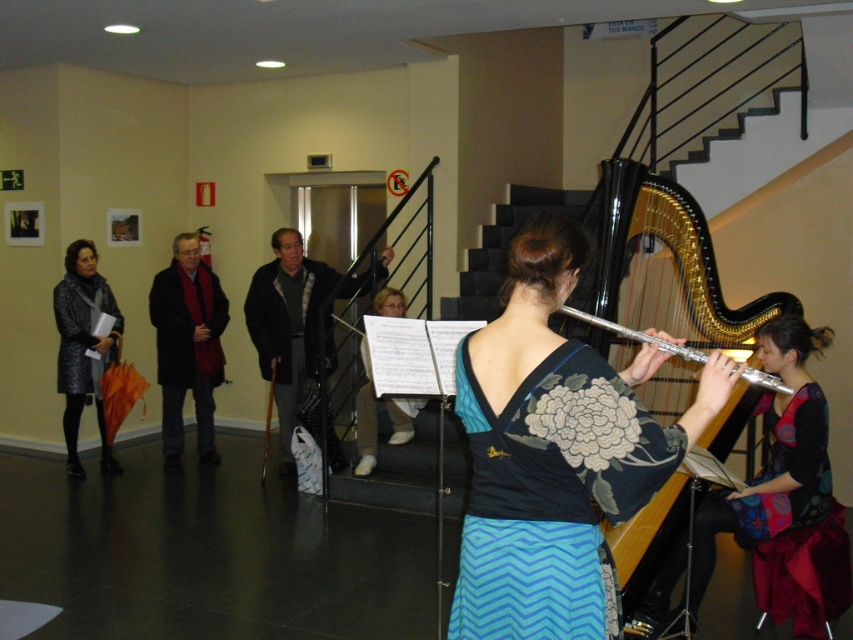
Which is more to the right, silk kimono at center or wooden flute at center?

silk kimono at center

Which is below, silk kimono at center or wooden flute at center?

wooden flute at center

Is point (548, 392) positioned after point (267, 433)?

No, it is in front of (267, 433).

Image resolution: width=853 pixels, height=640 pixels. Identify the location of silk kimono at center. (555, 452).

Who is positioned more to the left, silk kimono at center or blue zigzag fabric dress at center?

blue zigzag fabric dress at center

Looking at this image, is silk kimono at center bigger than blue zigzag fabric dress at center?

Correct, silk kimono at center is larger in size than blue zigzag fabric dress at center.

Between point (590, 435) and point (503, 440), which one is positioned behind?

Positioned behind is point (503, 440).

In order to click on silk kimono at center in this screenshot , I will do coord(555,452).

Looking at this image, is silk kimono at center taller than silver metallic flute at center?

Correct, silk kimono at center is much taller as silver metallic flute at center.

Can you confirm if silk kimono at center is positioned to the left of silver metallic flute at center?

Indeed, silk kimono at center is positioned on the left side of silver metallic flute at center.

Where is `silk kimono at center`? silk kimono at center is located at coordinates (555, 452).